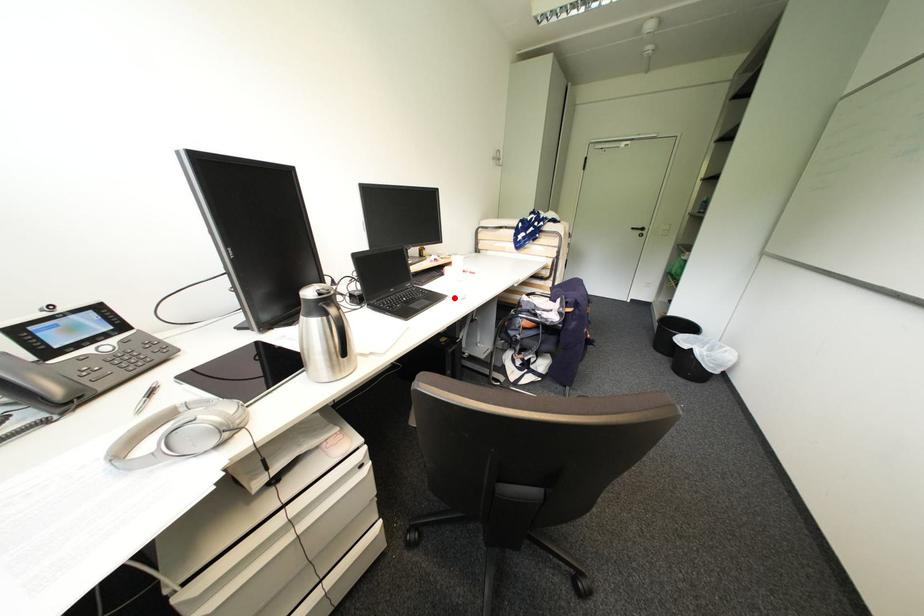
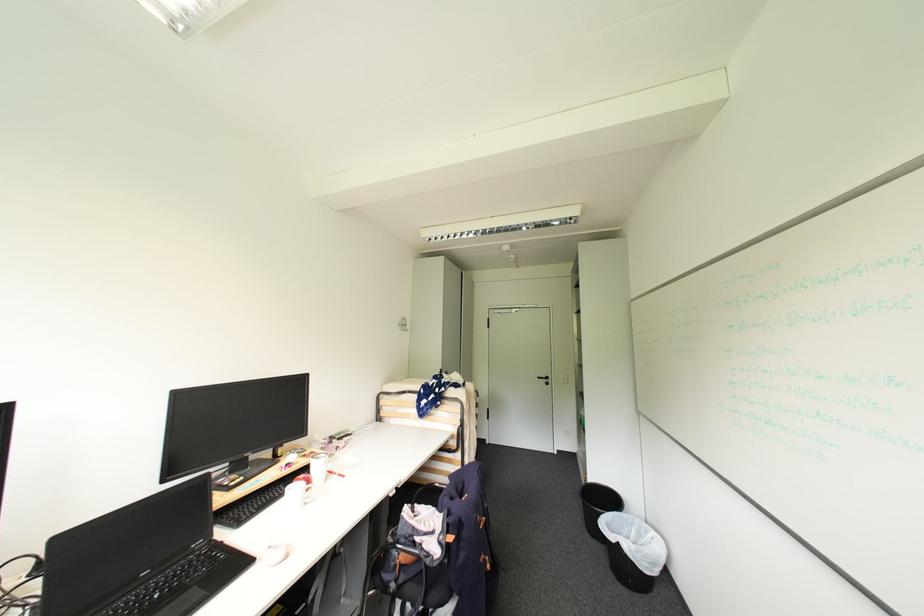
The point at the highlighted location is marked in the first image. Where is the corresponding point in the second image?

(263, 562)